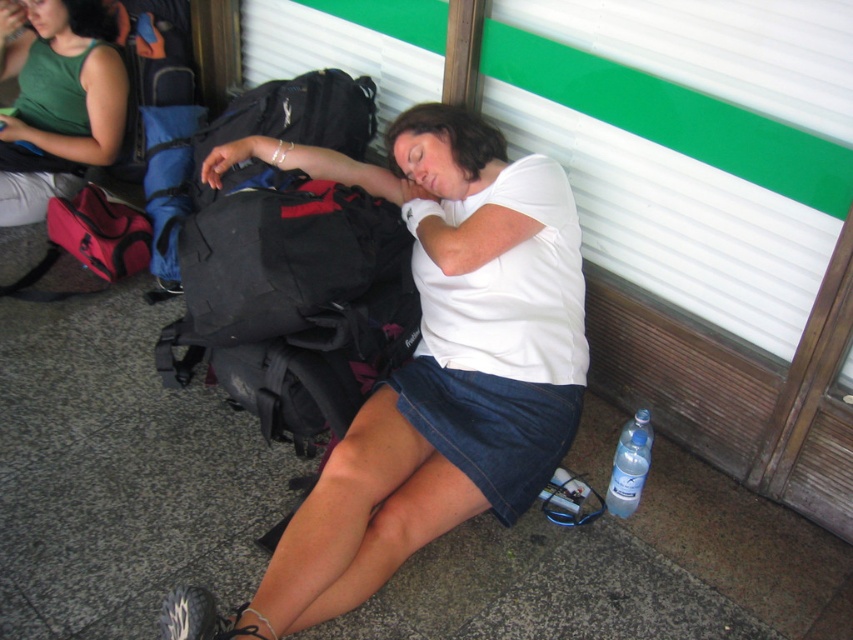
Question: From the image, what is the correct spatial relationship of green sleeveless top at upper left in relation to denim skirt at lower center?

Choices:
 (A) above
 (B) below

Answer: (A)

Question: Based on their relative distances, which object is farther from the green sleeveless top at upper left?

Choices:
 (A) white matte shirt at center
 (B) black leather sandal at lower center
 (C) denim skirt at lower center
 (D) clear plastic bottle at lower right

Answer: (D)

Question: Is white matte shirt at center to the left of green sleeveless top at upper left from the viewer's perspective?

Choices:
 (A) no
 (B) yes

Answer: (A)

Question: Which is farther from the clear plastic bottle at lower center?

Choices:
 (A) black leather sandal at lower center
 (B) white matte shirt at center
 (C) green sleeveless top at upper left
 (D) denim skirt at lower center

Answer: (C)

Question: Which object appears closest to the camera in this image?

Choices:
 (A) clear plastic bottle at lower center
 (B) clear plastic bottle at lower right
 (C) white matte shirt at center

Answer: (C)

Question: Does green sleeveless top at upper left have a smaller size compared to clear plastic bottle at lower right?

Choices:
 (A) no
 (B) yes

Answer: (A)